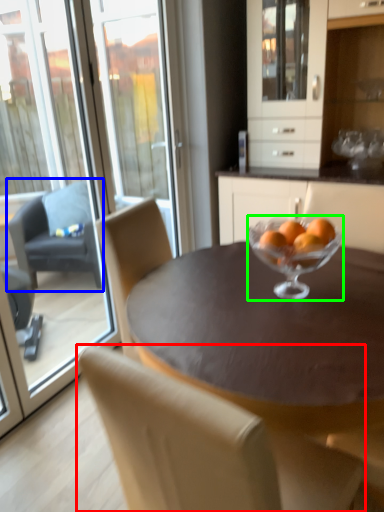
Question: Considering the real-world distances, which object is farthest from chair (highlighted by a red box)? chair (highlighted by a blue box) or martini glass (highlighted by a green box)?

Choices:
 (A) chair
 (B) martini glass

Answer: (A)